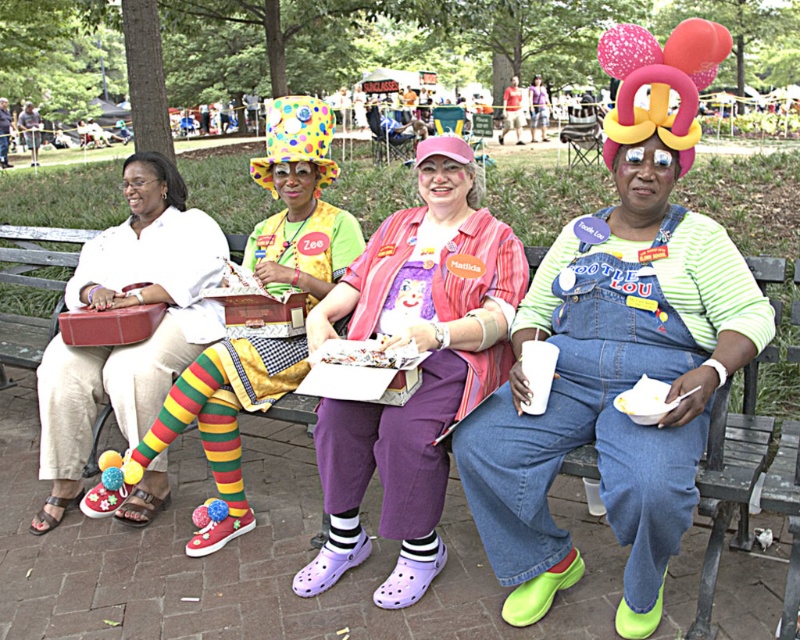
You are a photographer trying to capture a clear photo of the pink fabric dress at center and the striped socks at center. Since the people are moving, you need to focus on the one that is closer to you. Which one should you focus on?

The pink fabric dress at center is in front of the striped socks at center, so you should focus on the pink fabric dress at center as it is closer to you.

You are standing next to the wooden bench at center and want to take a photo of the four people sitting there. The camera you have is 6.56 feet away from the bench. Is the camera close enough to capture the entire group in one shot?

The camera is exactly 6.56 feet away from the wooden bench at center, which should be sufficient to capture the entire group in one shot, assuming the camera has a standard zoom capability.

You are standing at the center of the park bench and want to place a new item exactly where the beige fabric purse at left was previously located. What are the 2D coordinates where you should place the new item?

The beige fabric purse at left was located at coordinates (124, 307), so you should place the new item at those coordinates.